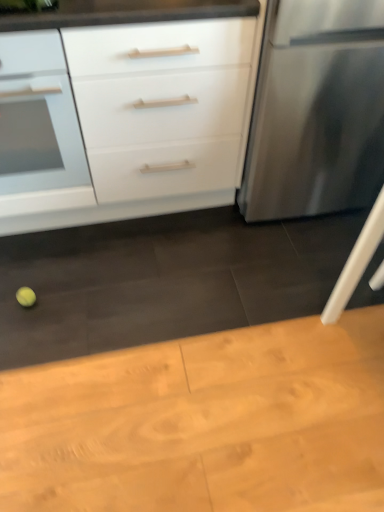
The height and width of the screenshot is (512, 384). Identify the location of free point above wooden table at lower center (from a real-world perspective). (213, 317).